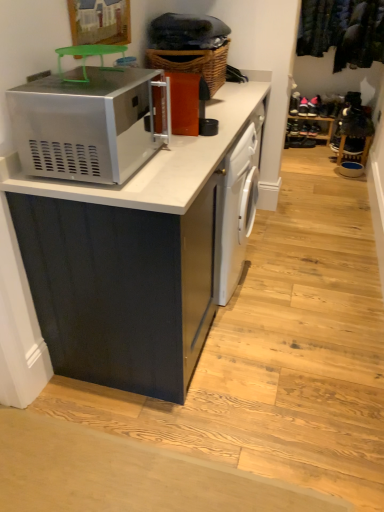
What are the coordinates of `free location above satin silver microwave at upper left (from a real-world perspective)` in the screenshot? It's located at (97, 80).